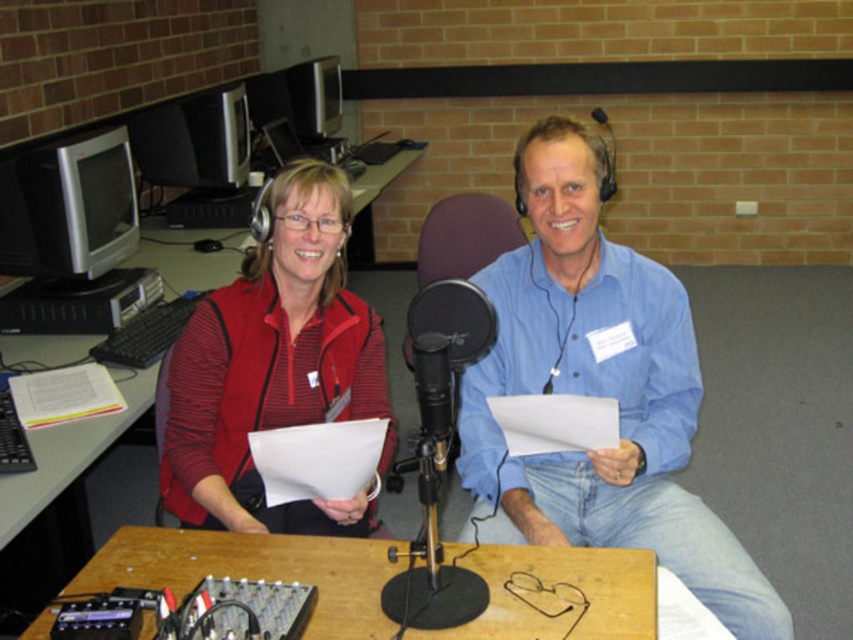
The width and height of the screenshot is (853, 640). What do you see at coordinates (274, 365) in the screenshot? I see `red striped shirt at center` at bounding box center [274, 365].

Between point (299, 323) and point (218, 557), which one is positioned in front?

Point (218, 557) is in front.

You are a GUI agent. You are given a task and a screenshot of the screen. Output one action in this format:
    pyautogui.click(x=<x>, y=<y>)
    Task: Click on the red striped shirt at center
    
    Given the screenshot: What is the action you would take?
    pyautogui.click(x=274, y=365)

Measure the distance between red striped shirt at center and camera.

red striped shirt at center and camera are 1.53 meters apart.

Which is behind, point (332, 208) or point (614, 161)?

Positioned behind is point (614, 161).

Is point (340, 339) less distant than point (595, 116)?

Yes, point (340, 339) is closer to viewer.

At what (x,y) coordinates should I click in order to perform the action: click on red striped shirt at center. Please return your answer as a coordinate pair (x, y). The width and height of the screenshot is (853, 640). Looking at the image, I should click on (274, 365).

Is point (602, 504) more distant than point (337, 588)?

Yes, it is behind point (337, 588).

Is point (579, 189) less distant than point (589, 636)?

No, (579, 189) is further to viewer.

What do you see at coordinates (596, 392) in the screenshot? I see `blue cotton shirt at center` at bounding box center [596, 392].

Where is `blue cotton shirt at center`? The image size is (853, 640). blue cotton shirt at center is located at coordinates (596, 392).